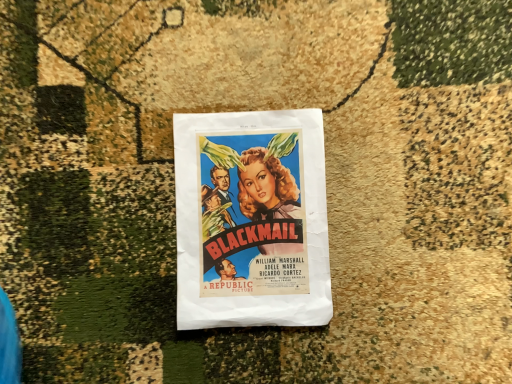
This screenshot has width=512, height=384. What do you see at coordinates (251, 220) in the screenshot?
I see `matte paper poster at center` at bounding box center [251, 220].

Image resolution: width=512 pixels, height=384 pixels. I want to click on matte paper poster at center, so click(x=251, y=220).

Identify the location of matte paper poster at center. This screenshot has height=384, width=512. (251, 220).